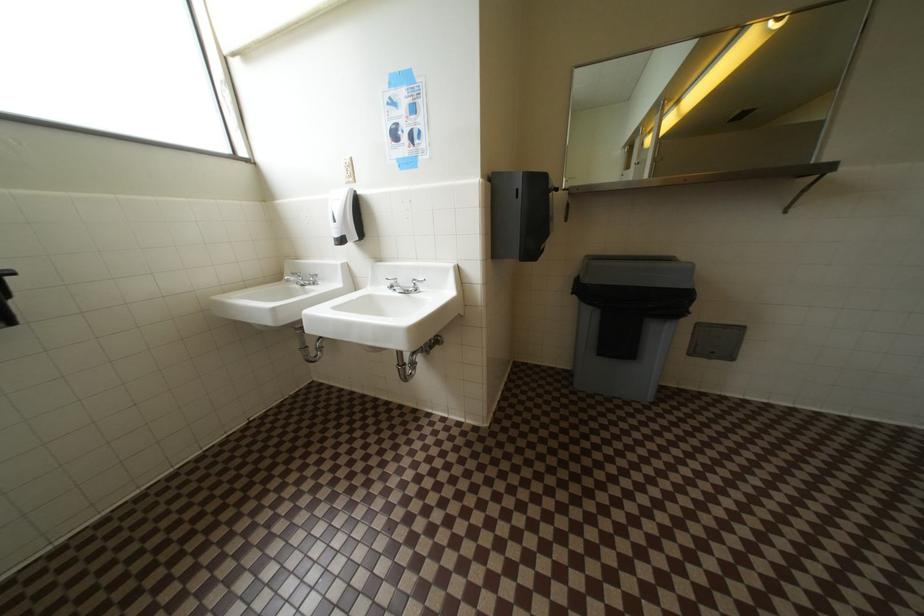
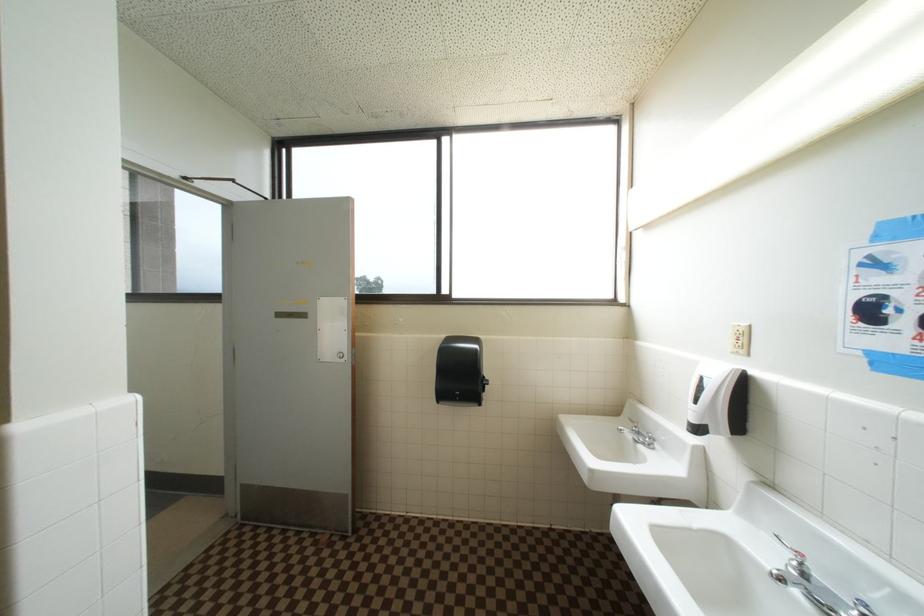
Question: The camera is either moving clockwise (left) or counter-clockwise (right) around the object. The first image is from the beginning of the video and the second image is from the end. Is the camera moving left or right when shooting the video?

Choices:
 (A) Left
 (B) Right

Answer: (B)